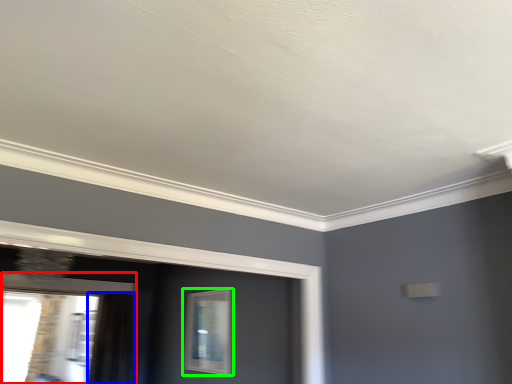
Question: Which is nearer to the window (highlighted by a red box)? curtain (highlighted by a blue box) or window (highlighted by a green box).

Choices:
 (A) curtain
 (B) window

Answer: (A)